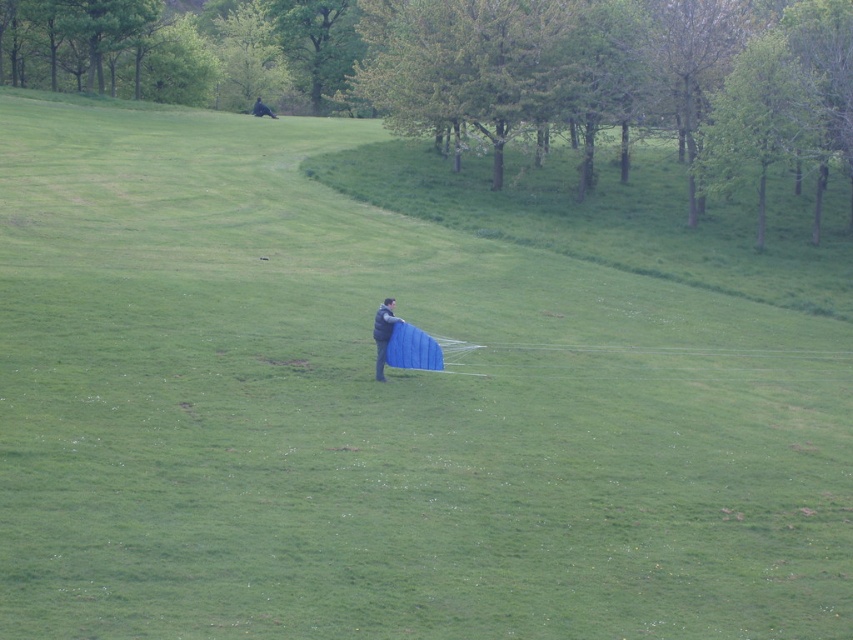
In the scene shown: Is green leafy tree at upper center above dark gray fabric kite at center?

Yes.

Is green leafy tree at upper center to the left of dark gray fabric kite at center from the viewer's perspective?

Indeed, green leafy tree at upper center is positioned on the left side of dark gray fabric kite at center.

You are a GUI agent. You are given a task and a screenshot of the screen. Output one action in this format:
    pyautogui.click(x=<x>, y=<y>)
    Task: Click on the green leafy tree at upper center
    Image resolution: width=853 pixels, height=640 pixels.
    Given the screenshot: What is the action you would take?
    pyautogui.click(x=442, y=60)

Locate an element on the screen. Image resolution: width=853 pixels, height=640 pixels. green leafy tree at upper center is located at coordinates (442, 60).

Is dark gray fabric kite at center below dark blue fabric at upper center?

Yes, dark gray fabric kite at center is below dark blue fabric at upper center.

Identify the location of dark gray fabric kite at center. The width and height of the screenshot is (853, 640). (383, 333).

Is green leafy tree at upper center shorter than dark blue fabric at upper center?

No, green leafy tree at upper center is not shorter than dark blue fabric at upper center.

Between green leafy tree at upper center and dark blue fabric at upper center, which one is positioned higher?

green leafy tree at upper center

Find the location of a particular element. Image resolution: width=853 pixels, height=640 pixels. green leafy tree at upper center is located at coordinates (442, 60).